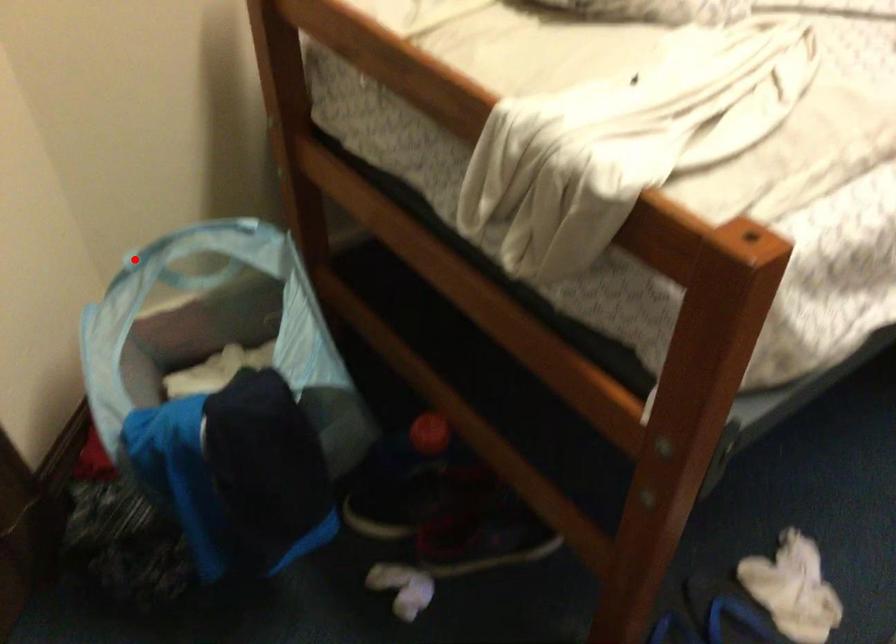
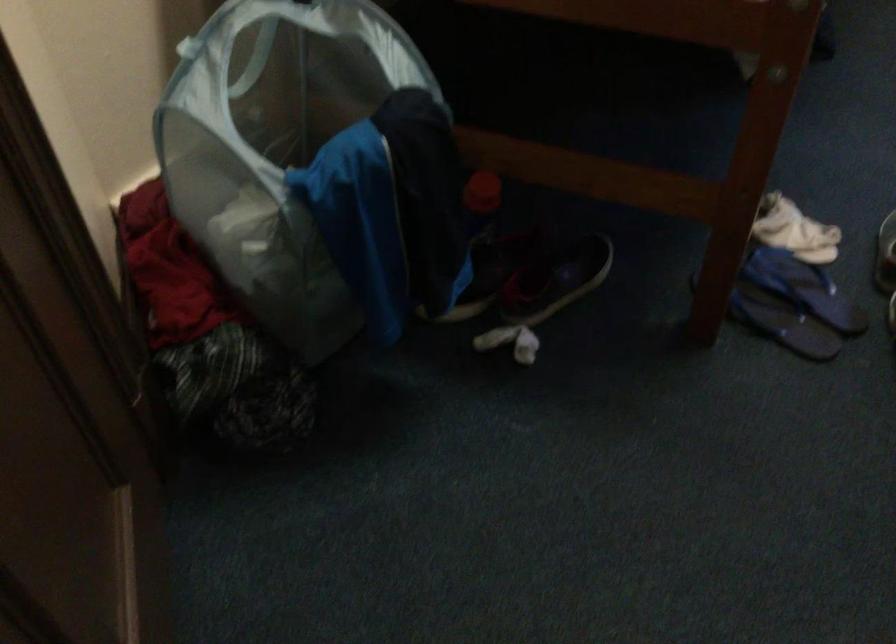
Find the pixel in the second image that matches the highlighted location in the first image.

(186, 46)